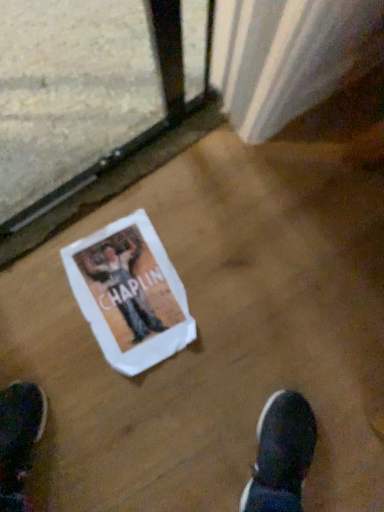
Question: In terms of height, does clear glass train window at lower left look taller or shorter compared to white paper flyer at center?

Choices:
 (A) tall
 (B) short

Answer: (A)

Question: Is point (198, 55) positioned closer to the camera than point (180, 283)?

Choices:
 (A) farther
 (B) closer

Answer: (B)

Question: From a real-world perspective, is clear glass train window at lower left above or below white paper flyer at center?

Choices:
 (A) above
 (B) below

Answer: (A)

Question: Is white paper flyer at center spatially inside clear glass train window at lower left, or outside of it?

Choices:
 (A) inside
 (B) outside

Answer: (B)

Question: Is white paper flyer at center wider or thinner than clear glass train window at lower left?

Choices:
 (A) wide
 (B) thin

Answer: (A)

Question: From their relative heights in the image, would you say white paper flyer at center is taller or shorter than clear glass train window at lower left?

Choices:
 (A) tall
 (B) short

Answer: (B)

Question: Is point [162, 280] closer or farther from the camera than point [195, 7]?

Choices:
 (A) closer
 (B) farther

Answer: (B)